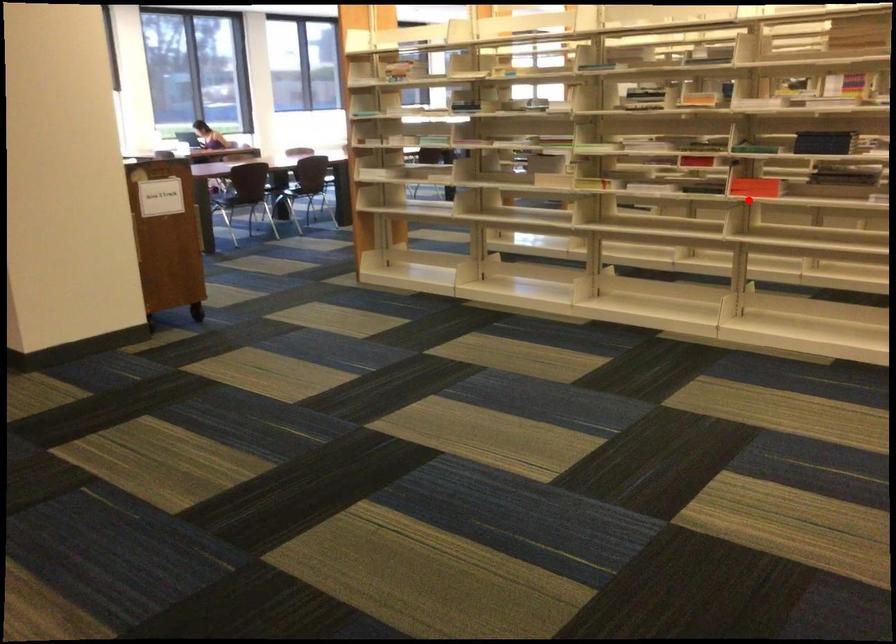
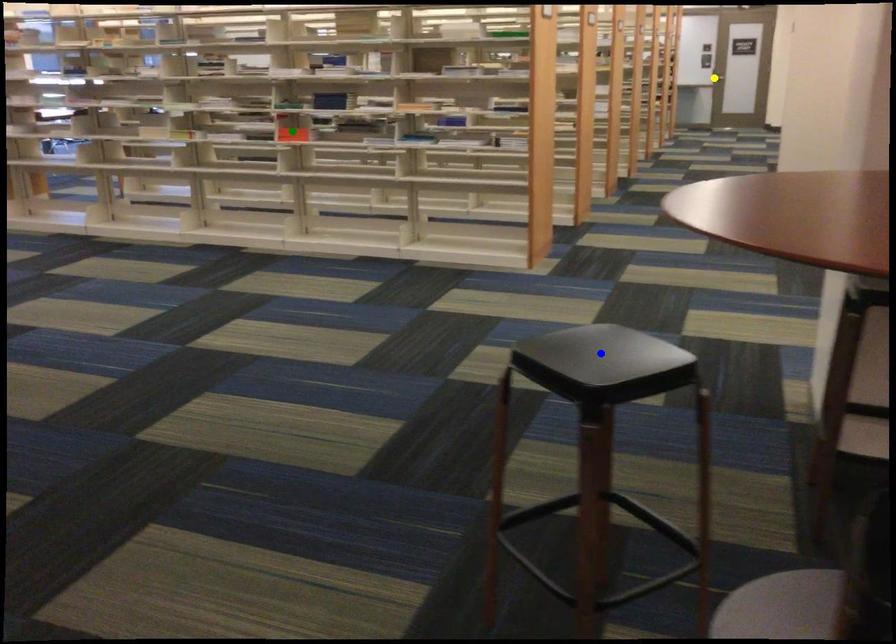
Question: I am providing you with two images of the same scene from different viewpoints. A red point is marked on the first image. You are given multiple points on the second image. Which mark in image 2 goes with the point in image 1?

Choices:
 (A) blue point
 (B) yellow point
 (C) green point

Answer: (C)